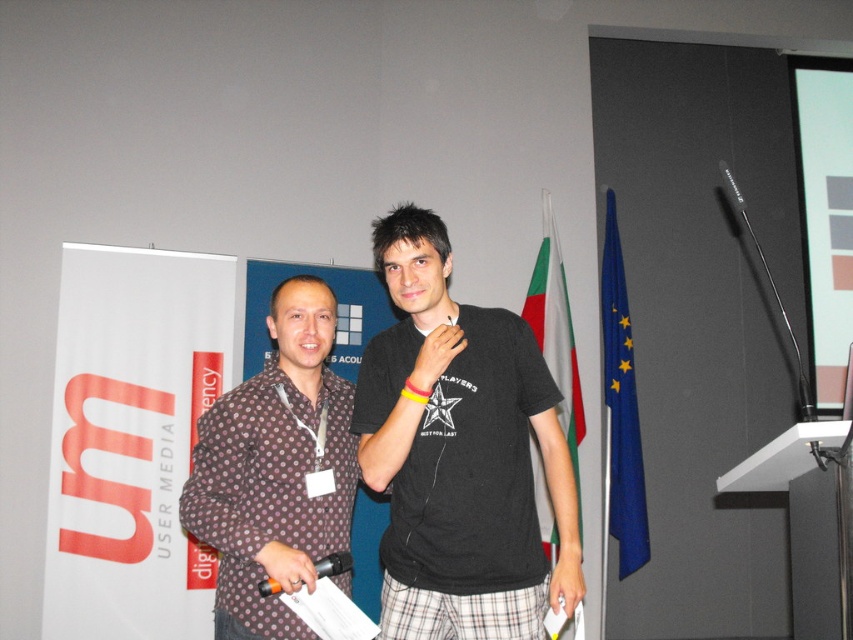
Question: Considering the real-world distances, which object is closest to the orange plastic microphone at center?

Choices:
 (A) brown dotted shirt at left
 (B) black cotton t-shirt at center

Answer: (A)

Question: Is black cotton t-shirt at center to the right of brown dotted shirt at left from the viewer's perspective?

Choices:
 (A) no
 (B) yes

Answer: (B)

Question: Which point is closer to the camera taking this photo?

Choices:
 (A) (210, 452)
 (B) (440, 525)
 (C) (264, 592)

Answer: (C)

Question: Which point appears farthest from the camera in this image?

Choices:
 (A) (447, 609)
 (B) (341, 518)
 (C) (346, 570)

Answer: (B)

Question: In this image, where is black cotton t-shirt at center located relative to orange plastic microphone at center?

Choices:
 (A) left
 (B) right

Answer: (B)

Question: Can you confirm if brown dotted shirt at left is positioned to the right of orange plastic microphone at center?

Choices:
 (A) yes
 (B) no

Answer: (B)